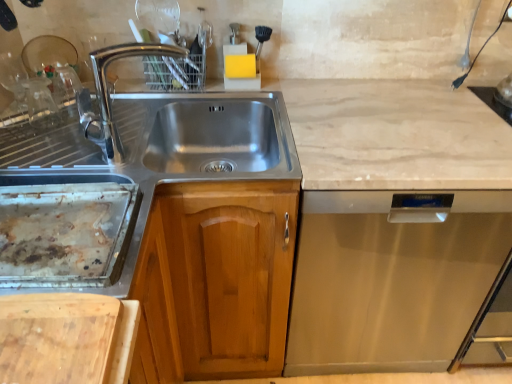
Question: From the image's perspective, would you say rusty metal tray at left is positioned over stainless steel dishwasher at right?

Choices:
 (A) no
 (B) yes

Answer: (B)

Question: Is rusty metal tray at left turned away from stainless steel dishwasher at right?

Choices:
 (A) no
 (B) yes

Answer: (A)

Question: Can stainless steel dishwasher at right be found inside rusty metal tray at left?

Choices:
 (A) yes
 (B) no

Answer: (B)

Question: Is rusty metal tray at left smaller than stainless steel dishwasher at right?

Choices:
 (A) no
 (B) yes

Answer: (B)

Question: From the image's perspective, is rusty metal tray at left below stainless steel dishwasher at right?

Choices:
 (A) no
 (B) yes

Answer: (A)

Question: Is rusty metal tray at left closer to the viewer compared to stainless steel dishwasher at right?

Choices:
 (A) yes
 (B) no

Answer: (A)

Question: Can you confirm if stainless steel dishwasher at right is positioned to the left of wooden cabinet at center?

Choices:
 (A) yes
 (B) no

Answer: (B)

Question: Considering the relative sizes of stainless steel dishwasher at right and wooden cabinet at center in the image provided, is stainless steel dishwasher at right bigger than wooden cabinet at center?

Choices:
 (A) no
 (B) yes

Answer: (B)

Question: Considering the relative positions of stainless steel dishwasher at right and wooden cabinet at center in the image provided, is stainless steel dishwasher at right in front of wooden cabinet at center?

Choices:
 (A) yes
 (B) no

Answer: (B)

Question: Is the surface of stainless steel dishwasher at right in direct contact with wooden cabinet at center?

Choices:
 (A) no
 (B) yes

Answer: (A)

Question: Can you confirm if stainless steel dishwasher at right is shorter than wooden cabinet at center?

Choices:
 (A) no
 (B) yes

Answer: (B)

Question: From the image's perspective, is stainless steel dishwasher at right beneath wooden cabinet at center?

Choices:
 (A) yes
 (B) no

Answer: (B)

Question: Are wooden cutting board at lower left and chrome metallic faucet at upper left located far from each other?

Choices:
 (A) yes
 (B) no

Answer: (B)